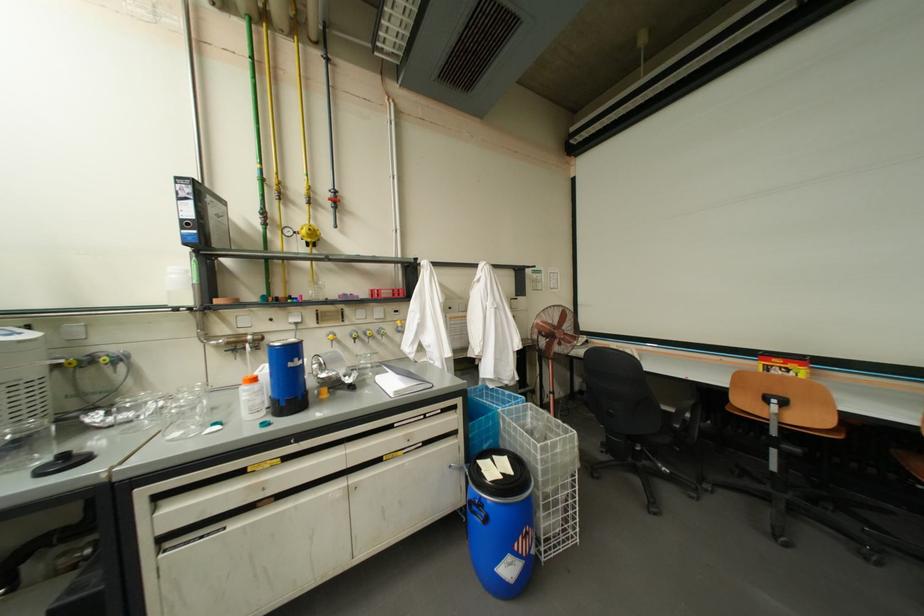
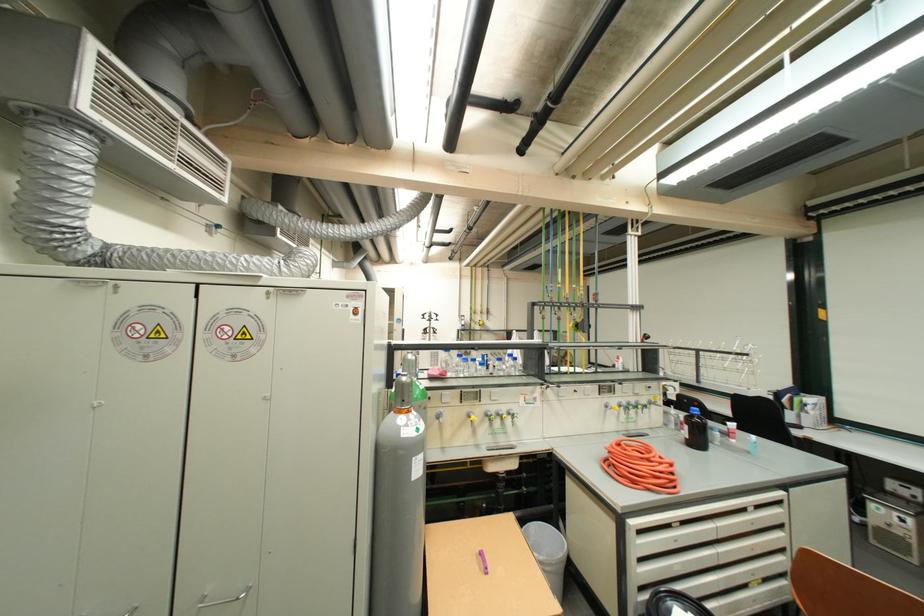
Question: The images are taken continuously from a first-person perspective. In which direction are you moving?

Choices:
 (A) Left
 (B) Right
 (C) Forward
 (D) Backward

Answer: (D)